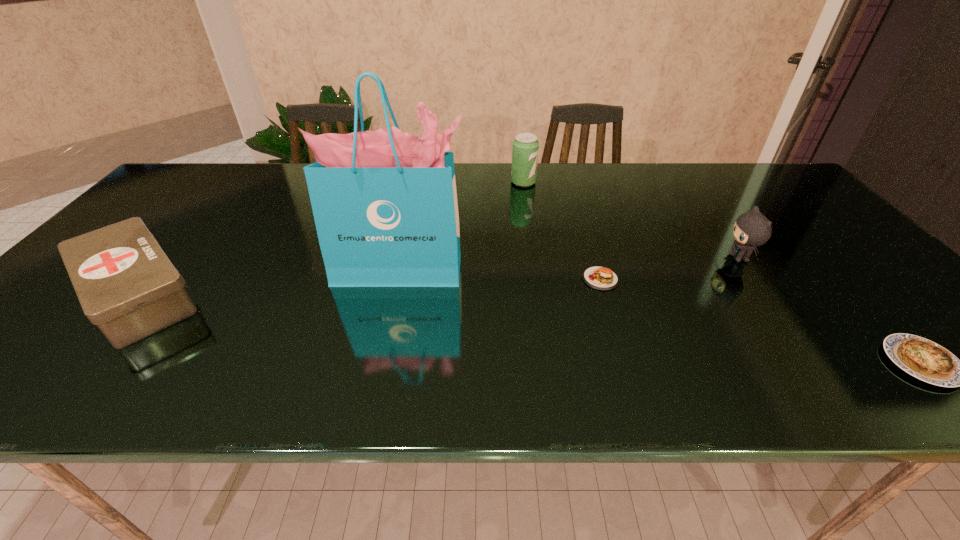
Identify the location of vacant area that lies between the shopping bag and the third shortest object. The height and width of the screenshot is (540, 960). (270, 282).

You are a GUI agent. You are given a task and a screenshot of the screen. Output one action in this format:
    pyautogui.click(x=<x>, y=<y>)
    Task: Click on the vacant space that is in between the tallest object and the fourth object from left to right
    
    Given the screenshot: What is the action you would take?
    pyautogui.click(x=501, y=274)

I want to click on empty location between the kitten and the patty (food), so coord(669,268).

Locate an element on the screen. The width and height of the screenshot is (960, 540). empty location between the first-aid kit and the shopping bag is located at coordinates (270, 282).

The image size is (960, 540). In order to click on free space between the patty (food) and the second object from left to right in this screenshot , I will do `click(501, 274)`.

Locate which object ranks in proximity to the farthest object. Please provide its 2D coordinates. Your answer should be formatted as a tuple, i.e. [(x, y)], where the tuple contains the x and y coordinates of a point satisfying the conditions above.

[(384, 202)]

This screenshot has height=540, width=960. I want to click on object that is the fifth nearest to the first-aid kit, so click(x=926, y=360).

Identify the location of vacant space that satisfies the following two spatial constraints: 1. on the front-facing side of the kitten; 2. on the front side of the shopping bag. (747, 269).

Find the location of a particular element. This screenshot has width=960, height=540. free location that satisfies the following two spatial constraints: 1. on the front side of the fourth object from left to right; 2. on the left side of the third object from left to right is located at coordinates (538, 279).

Locate an element on the screen. The width and height of the screenshot is (960, 540). free space in the image that satisfies the following two spatial constraints: 1. on the front side of the third object from right to left; 2. on the left side of the third object from left to right is located at coordinates (538, 279).